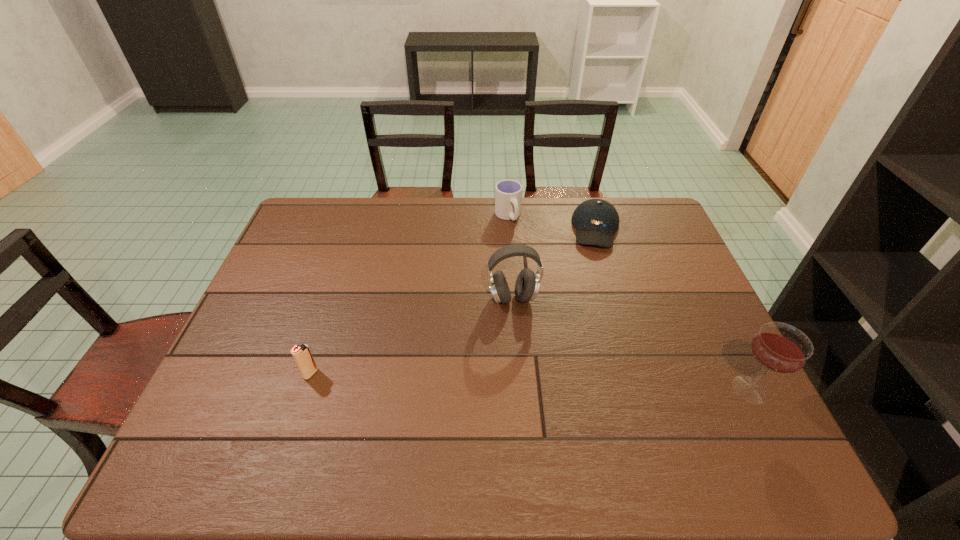
Image resolution: width=960 pixels, height=540 pixels. What are the coordinates of `vacant space on the desktop that is between the leftmost object and the rightmost object and is positioned on the ear cups of the third farthest object` in the screenshot? It's located at (520, 381).

Identify the location of free space on the desktop that is between the leftmost object and the rightmost object and is positioned with the handle on the side of the cup. (588, 383).

This screenshot has height=540, width=960. What are the coordinates of `vacant space on the desktop that is between the igniter and the wineglass and is positioned on the front-facing side of the shortest object` in the screenshot? It's located at (592, 384).